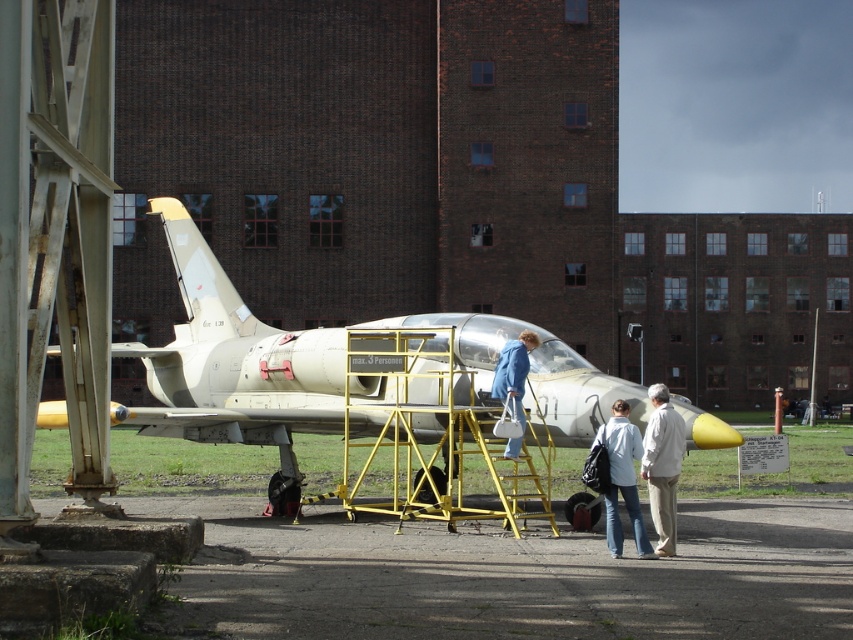
Question: Is concrete tarmac at lower center thinner than blue denim jacket at center?

Choices:
 (A) no
 (B) yes

Answer: (A)

Question: Which of the following is the closest to the observer?

Choices:
 (A) matte white airplane at center
 (B) blue denim jacket at center

Answer: (A)

Question: Which object is positioned closest to the light blue denim jacket at center?

Choices:
 (A) concrete tarmac at lower center
 (B) matte white airplane at center
 (C) white cotton shirt at lower right
 (D) blue denim jacket at center

Answer: (C)

Question: Does matte white airplane at center appear under blue denim jacket at center?

Choices:
 (A) yes
 (B) no

Answer: (B)

Question: Does matte white airplane at center have a lesser width compared to light blue denim jacket at center?

Choices:
 (A) yes
 (B) no

Answer: (B)

Question: Which point is farther from the camera taking this photo?

Choices:
 (A) (619, 452)
 (B) (506, 448)
 (C) (675, 436)

Answer: (B)